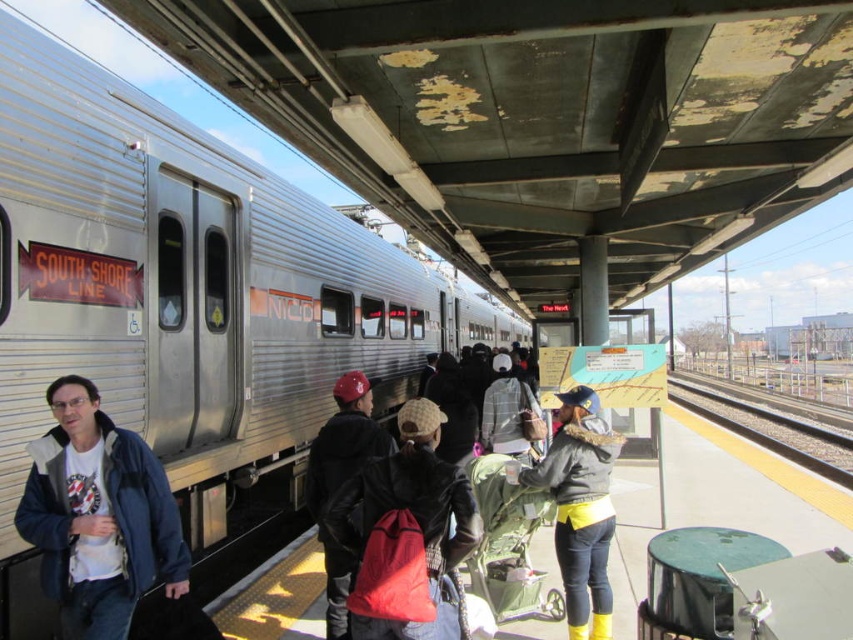
Locate an element on the screen. black leather jacket at center is located at coordinates (341, 483).

Does black leather jacket at center appear over yellow gravel train track at lower right?

Indeed, black leather jacket at center is positioned over yellow gravel train track at lower right.

The height and width of the screenshot is (640, 853). Describe the element at coordinates (341, 483) in the screenshot. I see `black leather jacket at center` at that location.

Where is `black leather jacket at center`? This screenshot has width=853, height=640. black leather jacket at center is located at coordinates (341, 483).

Can you confirm if matte black jacket at center is positioned below yellow gravel train track at lower right?

Incorrect, matte black jacket at center is not positioned below yellow gravel train track at lower right.

Can you confirm if matte black jacket at center is positioned to the left of yellow gravel train track at lower right?

Yes, matte black jacket at center is to the left of yellow gravel train track at lower right.

Does point (579, 420) come behind point (828, 470)?

No, it is in front of (828, 470).

Find the location of a particular element. matte black jacket at center is located at coordinates (579, 508).

Consider the image. Does matte blue jacket at center have a larger size compared to matte black jacket at center?

No, matte blue jacket at center is not bigger than matte black jacket at center.

Which is behind, point (71, 400) or point (576, 426)?

Point (576, 426)

Where is `matte blue jacket at center`? matte blue jacket at center is located at coordinates (97, 516).